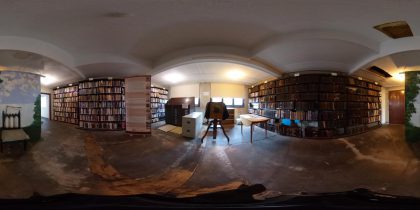
At what (x,y) coordinates should I click in order to perform the action: click on center wall. Please return your answer as a coordinate pair (x, y). This screenshot has height=210, width=420. Looking at the image, I should click on (222, 88).